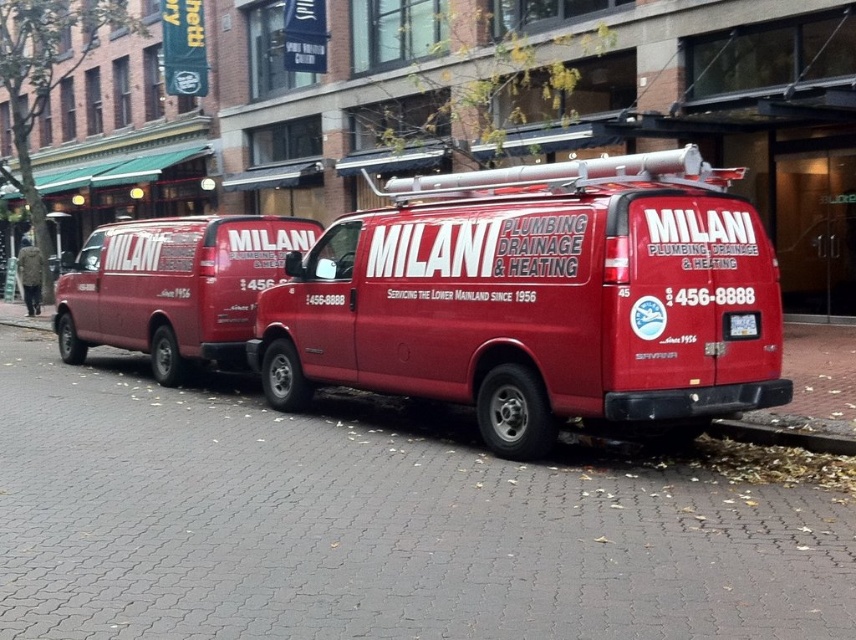
Question: Which object is the closest to the gray cobblestone pavement at center?

Choices:
 (A) smooth concrete curb at lower right
 (B) matte red van at center

Answer: (B)

Question: Can you confirm if gray cobblestone pavement at center is positioned to the left of matte red van at left?

Choices:
 (A) yes
 (B) no

Answer: (B)

Question: Does gray cobblestone pavement at center appear under matte red van at left?

Choices:
 (A) no
 (B) yes

Answer: (B)

Question: Can you confirm if gray cobblestone pavement at center is thinner than matte red van at left?

Choices:
 (A) no
 (B) yes

Answer: (A)

Question: Which object is positioned closest to the smooth concrete curb at lower right?

Choices:
 (A) gray cobblestone pavement at center
 (B) matte red van at center

Answer: (B)

Question: Which point is farther to the camera?

Choices:
 (A) matte red van at left
 (B) smooth concrete curb at lower right
 (C) matte red van at center
 (D) gray cobblestone pavement at center

Answer: (A)